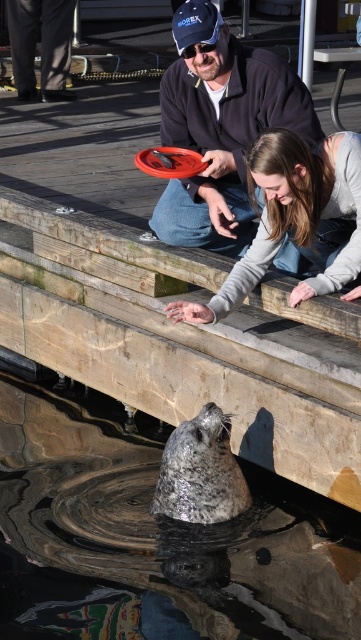
Can you confirm if wooden at center is positioned to the left of orange matte frisbee at center?

Yes, wooden at center is to the left of orange matte frisbee at center.

What do you see at coordinates (186, 346) in the screenshot? The image size is (361, 640). I see `wooden at center` at bounding box center [186, 346].

I want to click on wooden at center, so click(x=186, y=346).

Identify the location of grayish water at seal center. This screenshot has height=640, width=361. (159, 534).

How distant is grayish water at seal center from wooden at center?

grayish water at seal center is 1.01 meters from wooden at center.

Describe the element at coordinates (159, 534) in the screenshot. I see `grayish water at seal center` at that location.

Locate an element on the screen. grayish water at seal center is located at coordinates (159, 534).

Which is below, grayish water at seal center or matte black pants at upper left?

Positioned lower is grayish water at seal center.

Can you confirm if grayish water at seal center is bigger than matte black pants at upper left?

Indeed, grayish water at seal center has a larger size compared to matte black pants at upper left.

This screenshot has width=361, height=640. I want to click on grayish water at seal center, so click(x=159, y=534).